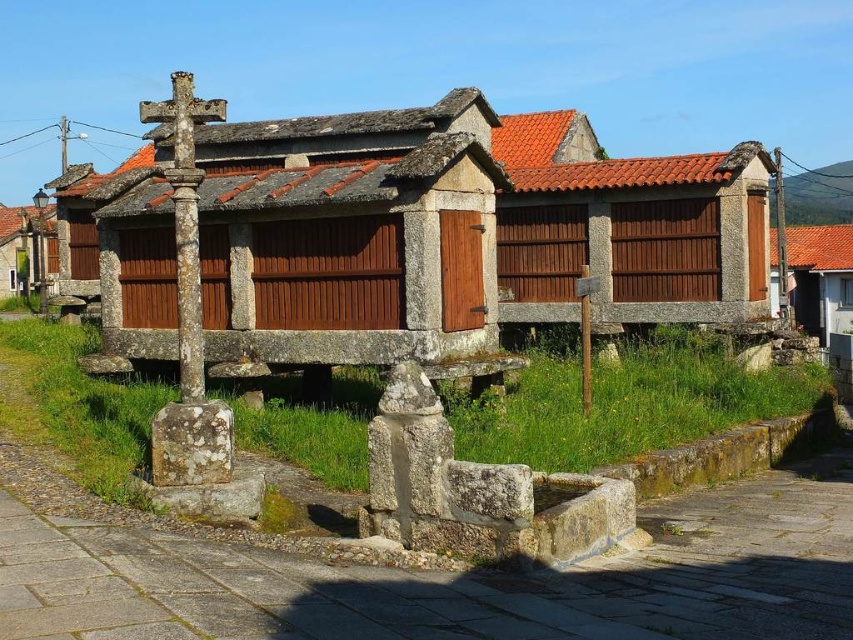
Does rusty stone cross at left appear on the right side of brown wooden hut at right?

In fact, rusty stone cross at left is to the left of brown wooden hut at right.

Can you confirm if rusty stone cross at left is positioned to the left of brown wooden hut at right?

Yes, rusty stone cross at left is to the left of brown wooden hut at right.

Where is `rusty stone cross at left`? rusty stone cross at left is located at coordinates (189, 312).

You are a GUI agent. You are given a task and a screenshot of the screen. Output one action in this format:
    pyautogui.click(x=<x>, y=<y>)
    Task: Click on the rusty stone cross at left
    
    Given the screenshot: What is the action you would take?
    pyautogui.click(x=189, y=312)

Does brown wooden hut at right have a larger size compared to brown wooden hut at left?

Actually, brown wooden hut at right might be smaller than brown wooden hut at left.

Locate an element on the screen. This screenshot has width=853, height=640. brown wooden hut at right is located at coordinates (820, 276).

Where is `brown wooden hut at right`? The image size is (853, 640). brown wooden hut at right is located at coordinates (820, 276).

This screenshot has height=640, width=853. What do you see at coordinates (457, 232) in the screenshot?
I see `brown wooden hut at center` at bounding box center [457, 232].

Is brown wooden hut at center thinner than rusty stone cross at left?

No, brown wooden hut at center is not thinner than rusty stone cross at left.

Who is more distant from viewer, (146, 352) or (209, 104)?

The point (146, 352) is more distant.

What are the coordinates of `brown wooden hut at center` in the screenshot? It's located at (457, 232).